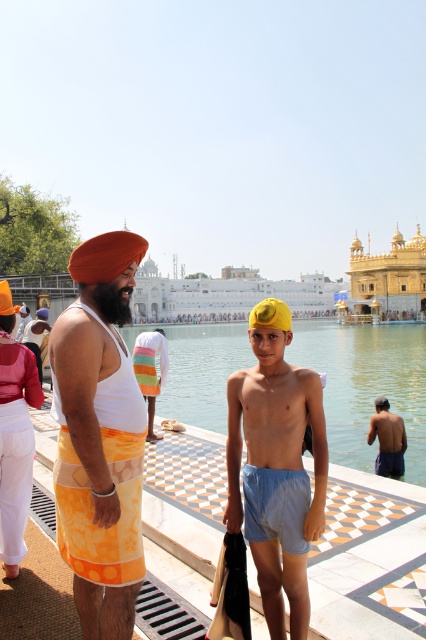
Consider the image. Does yellow fabric headwear at center have a lesser width compared to matte orange turban at upper left?

Yes, yellow fabric headwear at center is thinner than matte orange turban at upper left.

Can you confirm if yellow fabric headwear at center is taller than matte orange turban at upper left?

Yes.

Where is `yellow fabric headwear at center`? yellow fabric headwear at center is located at coordinates (276, 467).

This screenshot has width=426, height=640. What are the coordinates of `yellow fabric headwear at center` in the screenshot? It's located at (276, 467).

Does clear water at boy right have a greater height compared to light blue cotton shorts at lower right?

Correct, clear water at boy right is much taller as light blue cotton shorts at lower right.

Between clear water at boy right and light blue cotton shorts at lower right, which one is positioned lower?

Positioned lower is light blue cotton shorts at lower right.

Does point (377, 346) lie in front of point (400, 448)?

That is False.

Find the location of a particular element. This screenshot has height=640, width=426. clear water at boy right is located at coordinates (367, 385).

This screenshot has width=426, height=640. In order to click on matte orange turban at center in this screenshot , I will do `click(100, 436)`.

This screenshot has width=426, height=640. Describe the element at coordinates (100, 436) in the screenshot. I see `matte orange turban at center` at that location.

Who is more distant from viewer, (112, 436) or (109, 451)?

The point (112, 436) is more distant.

The image size is (426, 640). Identify the location of matte orange turban at center. (100, 436).